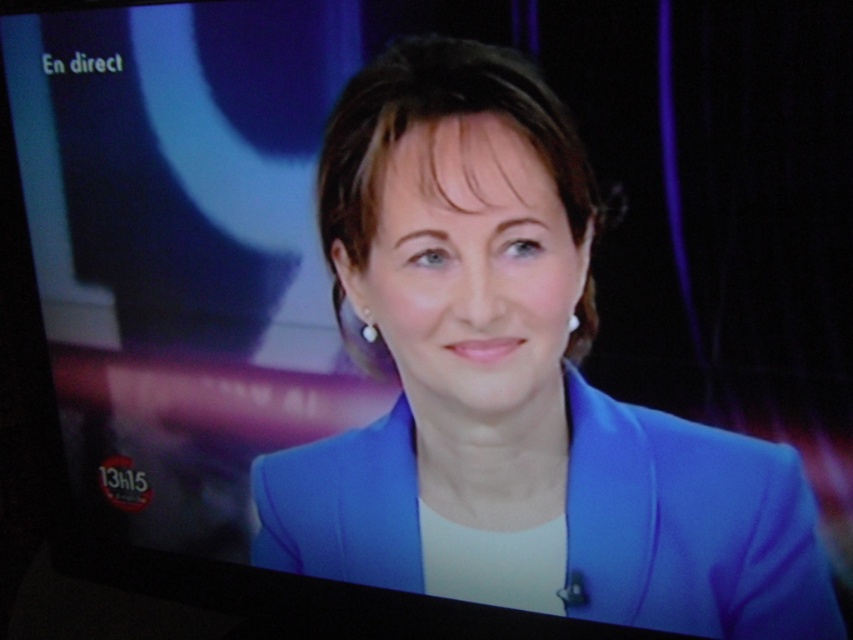
You are a costume designer preparing for a presentation. You have two blue items on your desk, a blue fabric jacket at center and a blue smooth blazer at center. You need to choose the larger one for a client who prefers oversized clothing. Which one should you pick?

The blue fabric jacket at center is bigger than the blue smooth blazer at center, so you should pick the blue fabric jacket at center for the client who prefers oversized clothing.

You are a costume designer reviewing the live broadcast on the TV screen. You notice two blue items worn by the presenter. Which one has a greater width? Please refer to the blue fabric jacket at center and the blue smooth blazer at center in your answer.

The blue fabric jacket at center has a greater width than the blue smooth blazer at center.